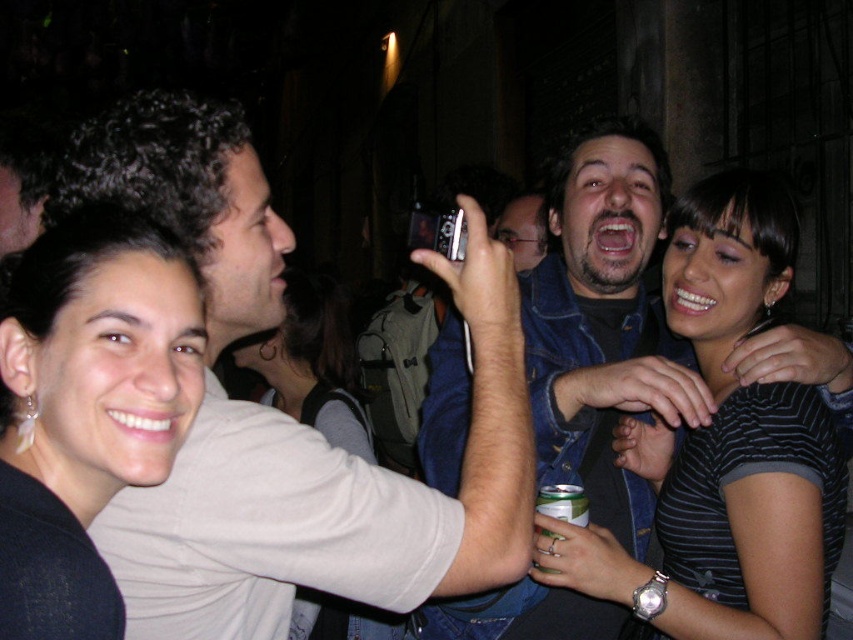
You are a photographer standing in the center of the scene. You need to locate the matte white shirt at upper left. According to the coordinates provided, where should you look?

The matte white shirt at upper left is located at point (328, 500).

You are a photographer standing at the edge of the group. You want to take a photo that includes both the striped fabric shirt at center and the black matte hair at upper left without cropping either. What is the minimum distance you need to move back to ensure both are fully in frame?

The striped fabric shirt at center and the black matte hair at upper left are 1.07 meters apart. To include both in the photo without cropping, you need to move back at least 1.07 meters so the camera can capture the full distance between them.

Based on the scene description, which object is shorter between the matte white shirt at upper left and the striped fabric shirt at center?

The matte white shirt at upper left is shorter than the striped fabric shirt at center according to the description.